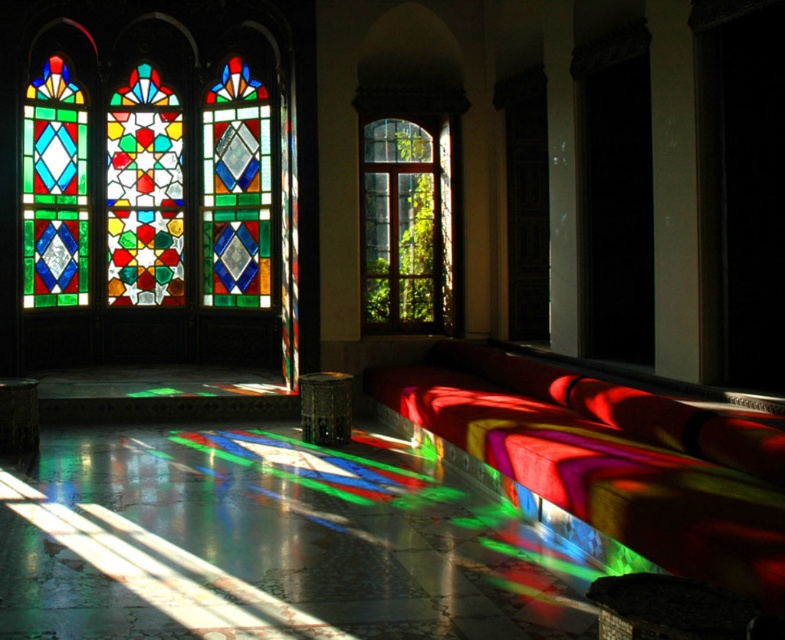
In the scene shown: Does stained glass window at upper left have a greater height compared to velvet red bench at center?

Correct, stained glass window at upper left is much taller as velvet red bench at center.

Can you confirm if stained glass window at upper left is positioned to the right of velvet red bench at center?

Incorrect, stained glass window at upper left is not on the right side of velvet red bench at center.

This screenshot has width=785, height=640. What do you see at coordinates (145, 179) in the screenshot?
I see `stained glass window at upper left` at bounding box center [145, 179].

Find the location of a particular element. Image resolution: width=785 pixels, height=640 pixels. stained glass window at upper left is located at coordinates (145, 179).

Is stained glass window at upper left shorter than clear glass window at center?

Incorrect, stained glass window at upper left's height does not fall short of clear glass window at center's.

Does stained glass window at upper left have a larger size compared to clear glass window at center?

Correct, stained glass window at upper left is larger in size than clear glass window at center.

Which is behind, point (53, 86) or point (378, 305)?

The point (53, 86) is more distant.

The height and width of the screenshot is (640, 785). I want to click on stained glass window at upper left, so click(145, 179).

Which of these two, velvet red bench at center or clear glass window at center, stands taller?

clear glass window at center

Looking at this image, which is more to the right, velvet red bench at center or clear glass window at center?

velvet red bench at center

The height and width of the screenshot is (640, 785). In order to click on velvet red bench at center in this screenshot , I will do `click(612, 458)`.

This screenshot has width=785, height=640. I want to click on velvet red bench at center, so click(612, 458).